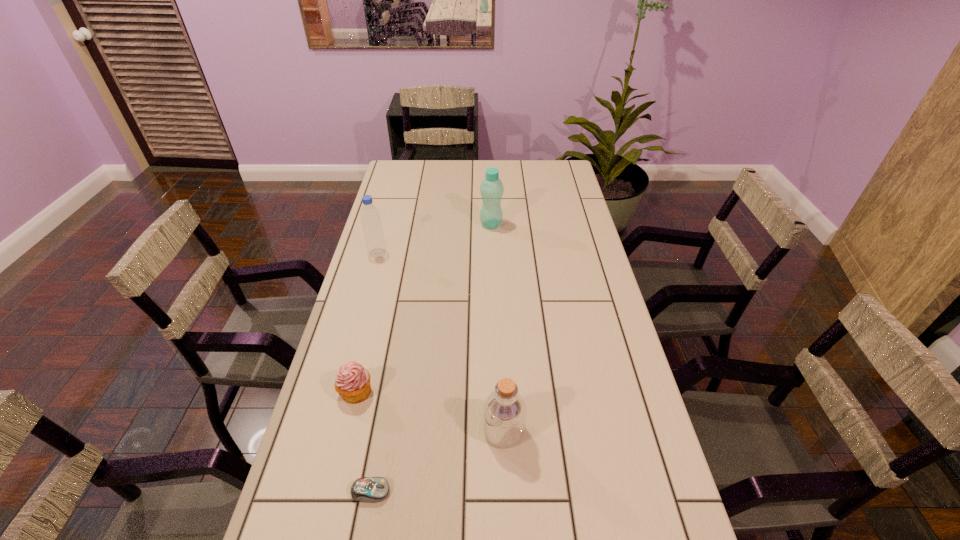
Find the location of a particular element. This screenshot has width=960, height=540. object that is the fourth nearest to the second nearest object is located at coordinates (491, 189).

You are a GUI agent. You are given a task and a screenshot of the screen. Output one action in this format:
    pyautogui.click(x=<x>, y=<y>)
    Task: Click on the third closest bottle to the second shortest object
    This screenshot has height=540, width=960.
    Given the screenshot: What is the action you would take?
    pyautogui.click(x=491, y=189)

Locate an element on the screen. The width and height of the screenshot is (960, 540). bottle that stands as the second closest to the cupcake is located at coordinates (370, 217).

This screenshot has height=540, width=960. I want to click on blank area in the image that satisfies the following two spatial constraints: 1. on the front side of the fourth nearest object; 2. on the left side of the fourth tallest object, so click(340, 392).

Identify the location of vacant space that satisfies the following two spatial constraints: 1. on the back side of the farthest bottle; 2. on the right side of the second shortest object. (396, 225).

You are a GUI agent. You are given a task and a screenshot of the screen. Output one action in this format:
    pyautogui.click(x=<x>, y=<y>)
    Task: Click on the vacant point that satisfies the following two spatial constraints: 1. on the back side of the farthest bottle; 2. on the right side of the leftmost bottle
    The image size is (960, 540).
    Given the screenshot: What is the action you would take?
    pyautogui.click(x=386, y=225)

This screenshot has width=960, height=540. I want to click on vacant space that satisfies the following two spatial constraints: 1. on the front side of the farthest bottle; 2. on the wheel side of the nearest object, so click(x=499, y=491).

Identify the location of vacant area in the image that satisfies the following two spatial constraints: 1. on the front side of the farthest object; 2. on the wheel side of the shortest object. Image resolution: width=960 pixels, height=540 pixels. (499, 491).